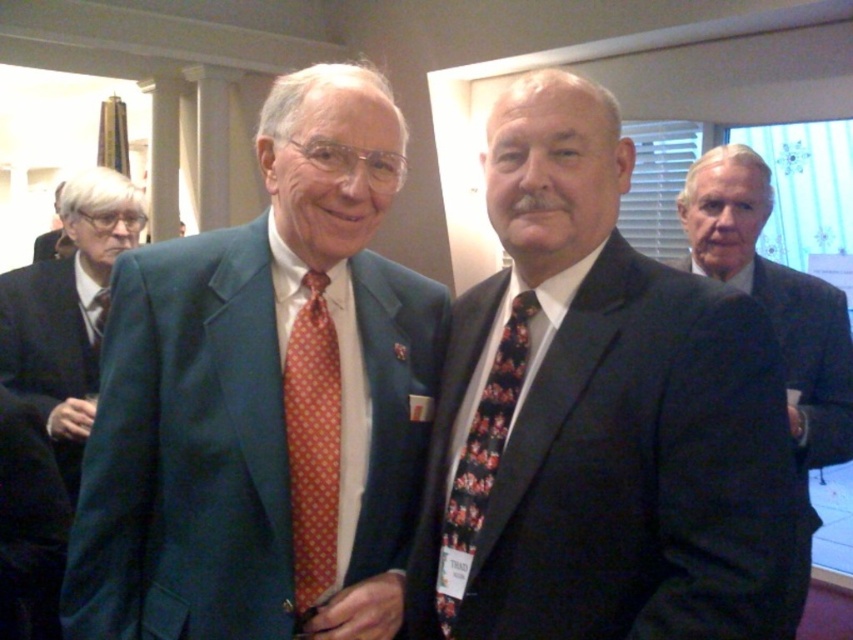
Based on the photo, you are a photographer at a formal event and need to adjust the lighting so that both the matte green suit at center and the dark suit at center are equally visible. Considering their positions, which suit is closer to the camera?

The dark suit at center is behind the matte green suit at center, so the matte green suit at center is closer to the camera and would need less light adjustment compared to the dark suit at center to ensure visibility.